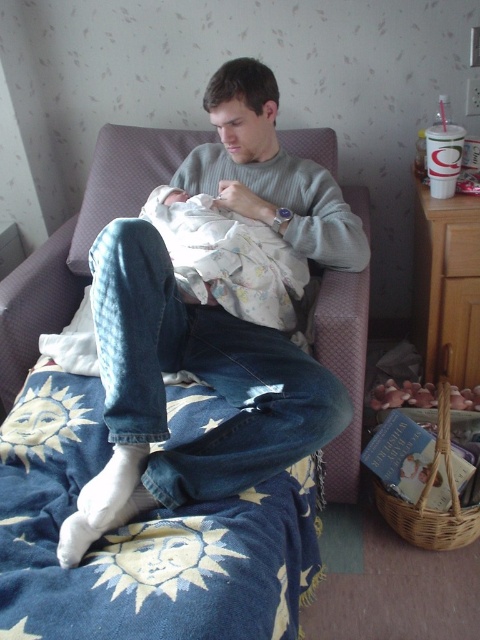
I want to click on denim jeans at center, so click(x=164, y=388).

Can you confirm if denim jeans at center is positioned to the right of floral cotton blanket at center?

Incorrect, denim jeans at center is not on the right side of floral cotton blanket at center.

The image size is (480, 640). Describe the element at coordinates (164, 388) in the screenshot. I see `denim jeans at center` at that location.

The image size is (480, 640). Identify the location of denim jeans at center. [164, 388].

Who is lower down, blue embroidered blanket at lower left or denim jeans at center?

blue embroidered blanket at lower left

Is blue embroidered blanket at lower left positioned before denim jeans at center?

That is True.

Does point (214, 538) come closer to viewer compared to point (140, 307)?

Yes.

The width and height of the screenshot is (480, 640). What are the coordinates of `blue embroidered blanket at lower left` in the screenshot? It's located at (142, 540).

Can you confirm if blue embroidered blanket at lower left is positioned to the left of floral cotton blanket at center?

Yes, blue embroidered blanket at lower left is to the left of floral cotton blanket at center.

The width and height of the screenshot is (480, 640). Identify the location of blue embroidered blanket at lower left. (142, 540).

What are the coordinates of `blue embroidered blanket at lower left` in the screenshot? It's located at (142, 540).